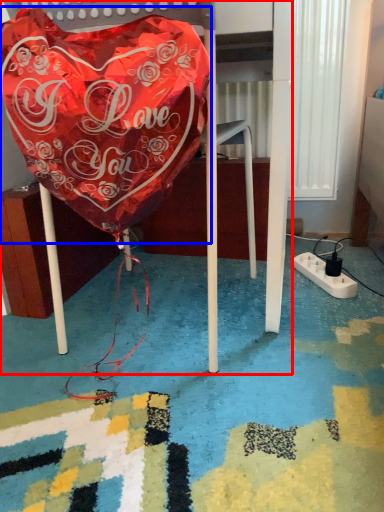
Question: Which object appears closest to the camera in this image, furniture (highlighted by a red box) or blanket (highlighted by a blue box)?

Choices:
 (A) furniture
 (B) blanket

Answer: (B)